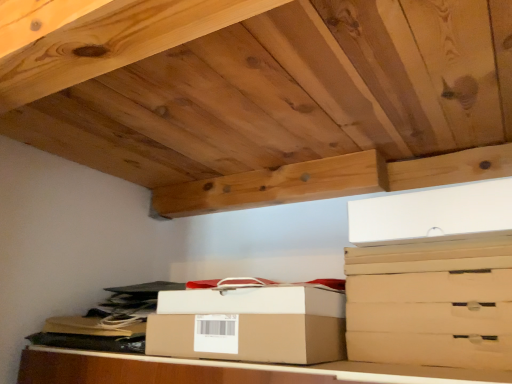
Question: Is brown cardboard drawer at right, acting as the 4th drawer starting from the bottom, wider or thinner than brown cardboard box at center?

Choices:
 (A) thin
 (B) wide

Answer: (A)

Question: From the image's perspective, is brown cardboard drawer at right, acting as the 4th drawer starting from the bottom, located above or below brown cardboard box at center?

Choices:
 (A) below
 (B) above

Answer: (B)

Question: Estimate the real-world distances between objects in this image. Which object is farther from the brown cardboard drawer at lower right, arranged as the 1th drawer when ordered from the bottom?

Choices:
 (A) white cardboard box at center, positioned as the 2th box in bottom-to-top order
 (B) matte cardboard drawer at center right, the 2th drawer positioned from the top
 (C) matte cardboard drawer at lower right, the third drawer viewed from the top
 (D) brown cardboard box at center
 (E) brown cardboard drawer at right, the 1th drawer positioned from the top

Answer: (A)

Question: Which is nearer to the matte cardboard drawer at lower right, the second drawer when ordered from bottom to top?

Choices:
 (A) brown cardboard box at center, marked as the second box in a top-to-bottom arrangement
 (B) brown cardboard drawer at lower right, arranged as the 1th drawer when ordered from the bottom
 (C) matte cardboard drawer at center right, the 3th drawer when ordered from bottom to top
 (D) white cardboard box at center, which ranks as the 1th box in top-to-bottom order
 (E) brown cardboard drawer at right, the 1th drawer positioned from the top

Answer: (B)